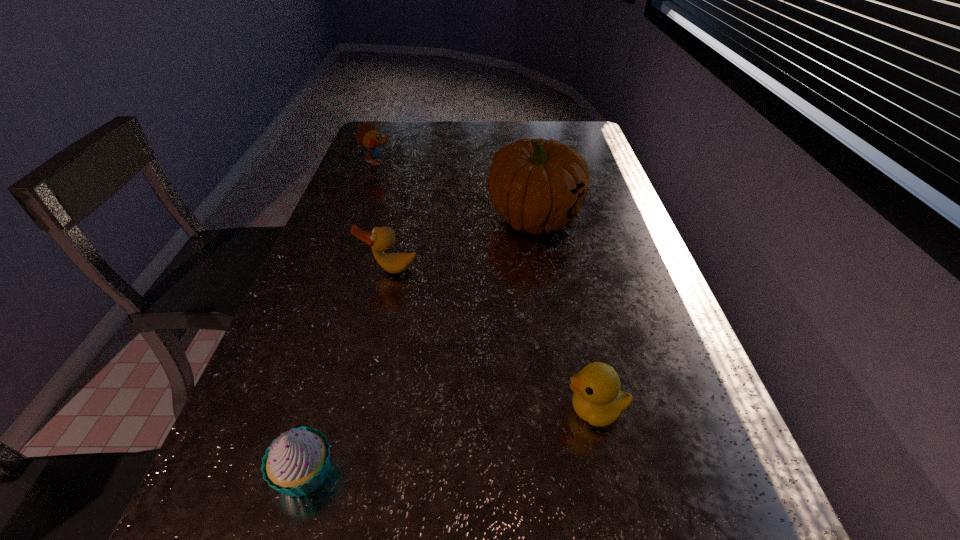
Locate an element on the screen. The image size is (960, 540). pumpkin is located at coordinates (537, 185).

Where is `the fourth nearest object`? The height and width of the screenshot is (540, 960). the fourth nearest object is located at coordinates (537, 185).

Identify the location of the leftmost duck. This screenshot has width=960, height=540. (368, 135).

Identify the location of the farthest object. This screenshot has width=960, height=540. (368, 135).

Identify the location of the second farthest duck. (380, 239).

Identify the location of the third nearest object. This screenshot has height=540, width=960. (380, 239).

In order to click on the rightmost duck in this screenshot , I will do `click(597, 399)`.

You are a GUI agent. You are given a task and a screenshot of the screen. Output one action in this format:
    pyautogui.click(x=<x>, y=<y>)
    Task: Click on the nearest duck
    The width and height of the screenshot is (960, 540).
    Given the screenshot: What is the action you would take?
    click(x=597, y=399)

Where is `cupcake`? cupcake is located at coordinates (296, 463).

Image resolution: width=960 pixels, height=540 pixels. In order to click on vacant space located on the surface of the tallest object in this screenshot , I will do `click(557, 353)`.